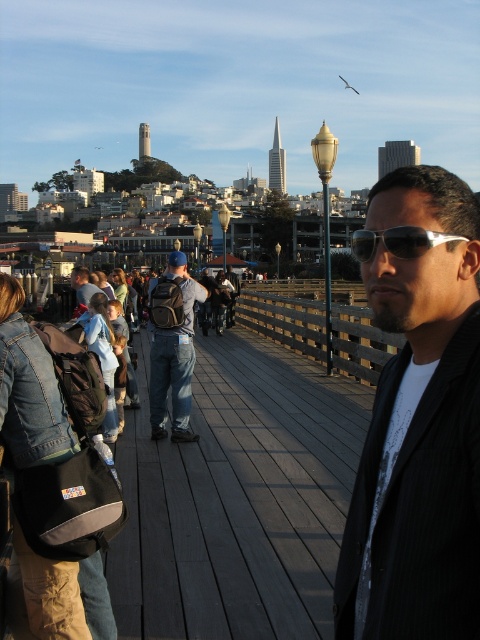
Question: Considering the real-world distances, which object is closest to the black pinstripe suit at center?

Choices:
 (A) wooden at center
 (B) denim jacket at center
 (C) sunglasses at center

Answer: (C)

Question: Among these points, which one is nearest to the camera?

Choices:
 (A) (446, 301)
 (B) (201, 285)
 (C) (359, 246)

Answer: (A)

Question: Can you confirm if matte black backpack at center is thinner than denim jacket at center?

Choices:
 (A) yes
 (B) no

Answer: (A)

Question: Where is matte black backpack at center located in relation to sunglasses at center in the image?

Choices:
 (A) below
 (B) above

Answer: (A)

Question: Which is nearer to the denim jacket at center?

Choices:
 (A) black pinstripe suit at center
 (B) wooden at center
 (C) matte black backpack at center

Answer: (C)

Question: Observing the image, what is the correct spatial positioning of black pinstripe suit at center in reference to wooden at center?

Choices:
 (A) above
 (B) below

Answer: (B)